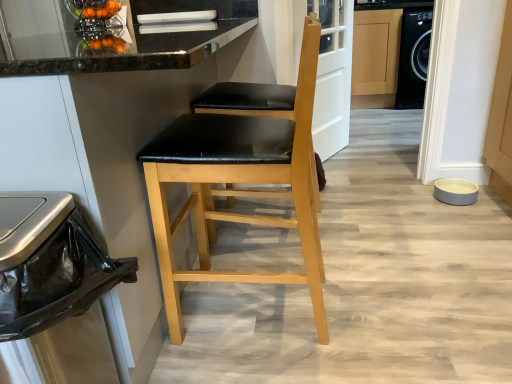
Question: Looking at their shapes, would you say gray matte pet bowl at lower right, the second appliance positioned from the left, is wider or thinner than matte black seat at center, which is counted as the 2th chair, starting from the front?

Choices:
 (A) thin
 (B) wide

Answer: (A)

Question: Considering the positions of gray matte pet bowl at lower right, the second appliance positioned from the left, and matte black seat at center, which is counted as the 2th chair, starting from the front, in the image, is gray matte pet bowl at lower right, the second appliance positioned from the left, bigger or smaller than matte black seat at center, which is counted as the 2th chair, starting from the front,?

Choices:
 (A) small
 (B) big

Answer: (A)

Question: Estimate the real-world distances between objects in this image. Which object is closer to the matte black seat at center, which is counted as the 2th chair, starting from the front?

Choices:
 (A) metallic trash can at left
 (B) matte wood cabinet at center
 (C) black leather chair at center, arranged as the first chair when viewed from the front
 (D) metallic silver fruit bowl at upper left, the second appliance positioned from the bottom
 (E) gray matte pet bowl at lower right, which is the first appliance in bottom-to-top order

Answer: (C)

Question: Estimate the real-world distances between objects in this image. Which object is farther from the metallic silver fruit bowl at upper left, the first appliance when ordered from top to bottom?

Choices:
 (A) matte wood cabinet at center
 (B) black leather chair at center, positioned as the second chair in back-to-front order
 (C) metallic trash can at left
 (D) gray matte pet bowl at lower right, the second appliance positioned from the left
 (E) matte black seat at center, which is counted as the 2th chair, starting from the front

Answer: (A)